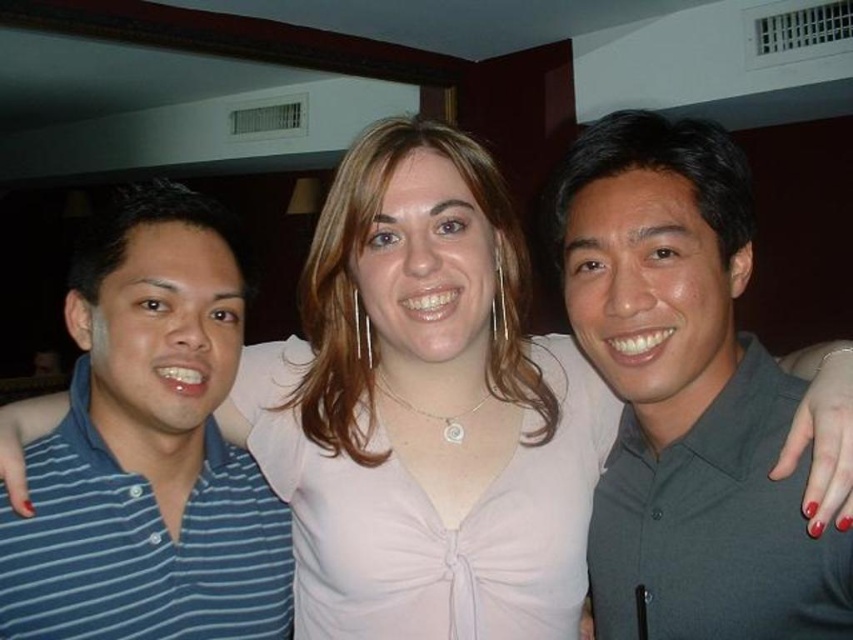
You are standing in a dimly lit room and want to take a photo of the gray matte shirt at center. If your camera has a minimum focusing distance of 60 centimeters, will you need to move closer or farther away to ensure the shirt is in focus?

The gray matte shirt at center is currently 70.96 centimeters away from you. Since your camera can focus as close as 60 centimeters, you need to move closer to the gray matte shirt at center to ensure it is within the camera

You are trying to identify the spatial arrangement of the two individuals in the photo. Given that the gray matte shirt at center is positioned on the right side of the blue striped polo shirt at left, which person is farther to the left?

The blue striped polo shirt at left is farther to the left because the gray matte shirt at center is positioned to its right side.

You are standing in a dimly lit room, possibly a bar or lounge, and there is a point marked at coordinates point (850, 561). If you want to reach this point without moving your feet, can you do so with your arm?

The point (850, 561) is 28.26 inches away from the viewer. Since the average human arm length is about 27 inches, you might not be able to reach it without moving your feet.